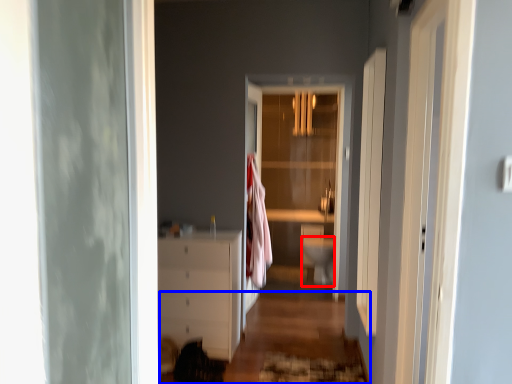
Question: Which object is further to the camera taking this photo, toilet bowl (highlighted by a red box) or path (highlighted by a blue box)?

Choices:
 (A) toilet bowl
 (B) path

Answer: (A)